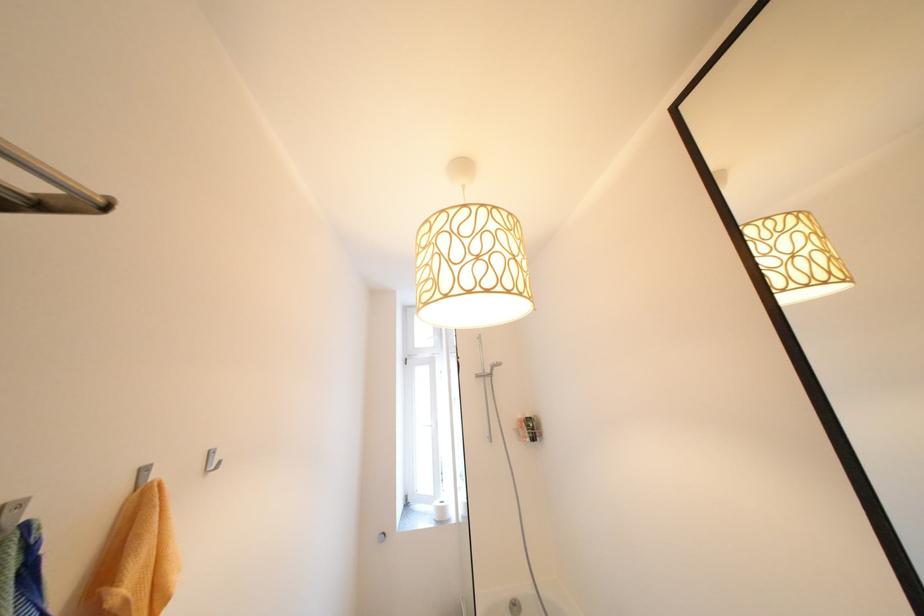
Where is `metal towel rack bar`? Image resolution: width=924 pixels, height=616 pixels. metal towel rack bar is located at coordinates (51, 175).